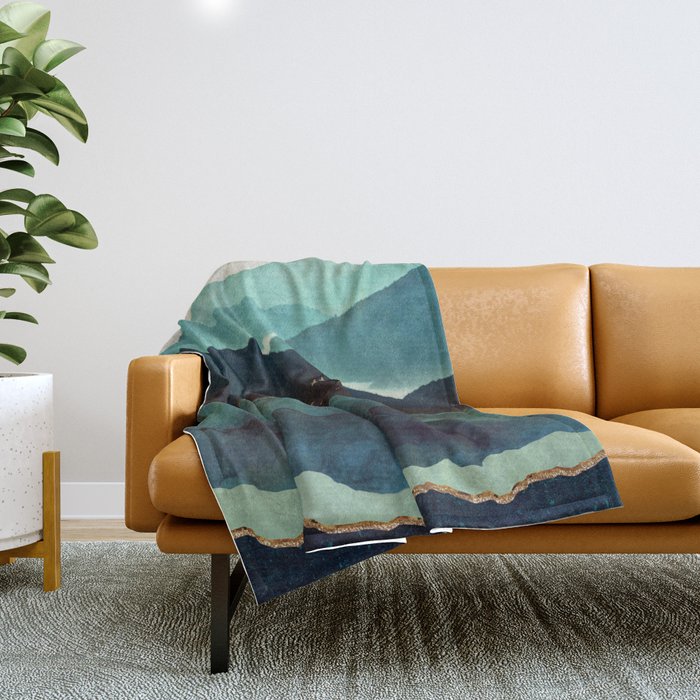
Where is `throw blanket`? This screenshot has width=700, height=700. throw blanket is located at coordinates (421, 444).